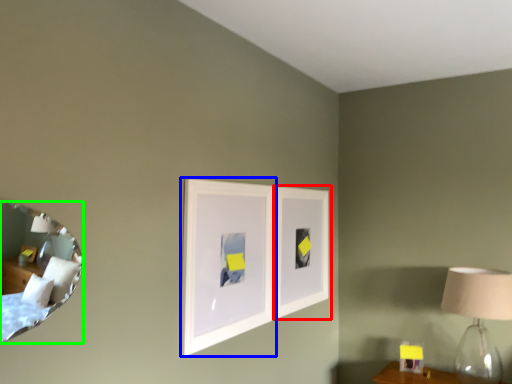
Question: Estimate the real-world distances between objects in this image. Which object is farther from picture frame (highlighted by a red box), picture frame (highlighted by a blue box) or mirror (highlighted by a green box)?

Choices:
 (A) picture frame
 (B) mirror

Answer: (B)